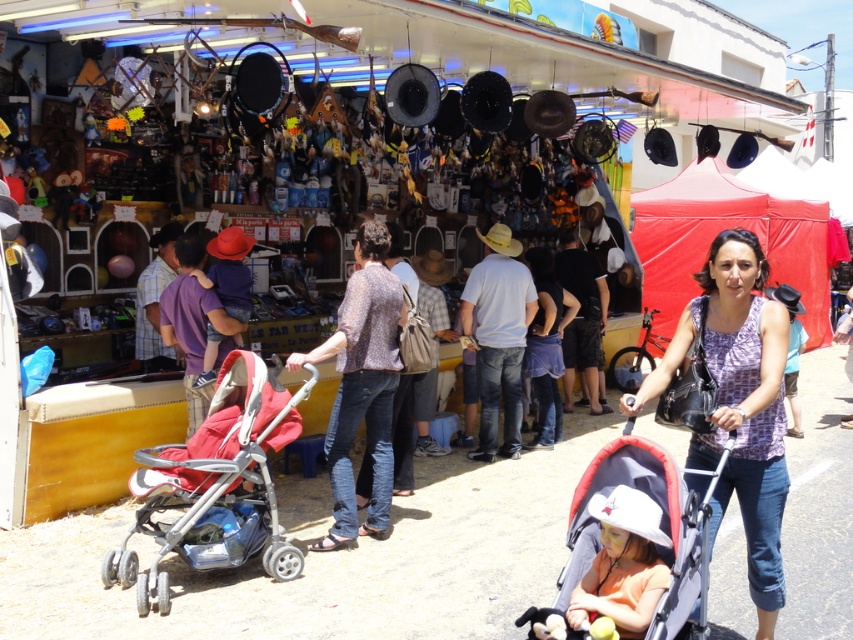
Question: Does printed fabric blouse at center have a larger size compared to gray fabric stroller at lower center?

Choices:
 (A) yes
 (B) no

Answer: (A)

Question: Is printed fabric blouse at center to the left of gray fabric stroller at lower center from the viewer's perspective?

Choices:
 (A) no
 (B) yes

Answer: (A)

Question: Which point appears closest to the camera in this image?

Choices:
 (A) (294, 404)
 (B) (654, 452)

Answer: (B)

Question: Which point is farther from the camera taking this photo?

Choices:
 (A) (720, 301)
 (B) (653, 458)
 (C) (152, 460)

Answer: (C)

Question: Is gray fabric stroller at lower center smaller than red fabric stroller at center?

Choices:
 (A) no
 (B) yes

Answer: (B)

Question: Among these objects, which one is farthest from the camera?

Choices:
 (A) gray fabric stroller at lower center
 (B) printed fabric blouse at center

Answer: (B)